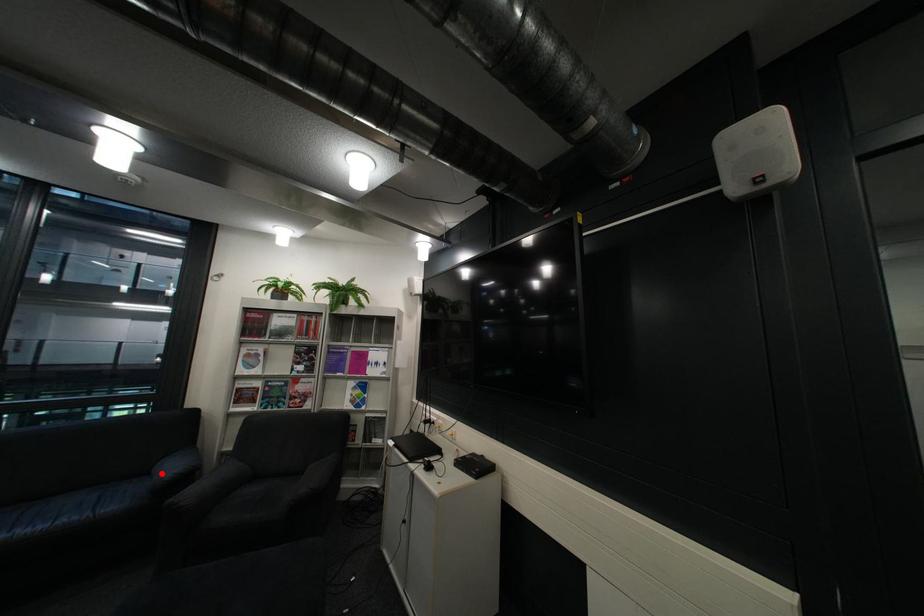
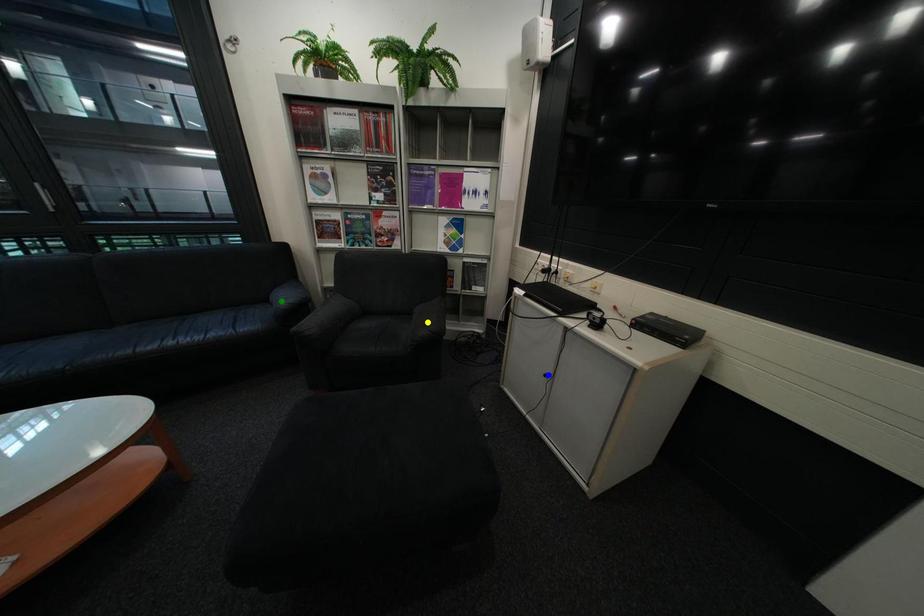
Question: I am providing you with two images of the same scene from different viewpoints. A red point is marked on the first image. You are given multiple points on the second image. Which point in image 2 is actually the same real-world point as the red point in image 1?

Choices:
 (A) yellow point
 (B) green point
 (C) blue point

Answer: (B)